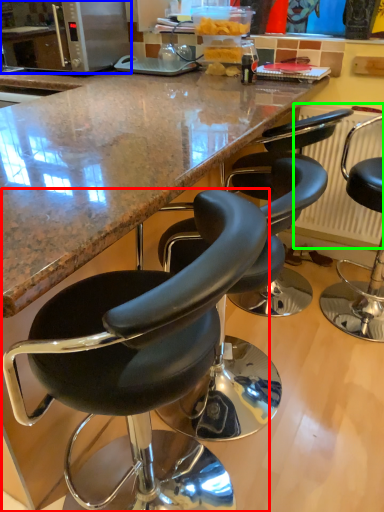
Question: Estimate the real-world distances between objects in this image. Which object is closer to chair (highlighted by a red box), microwave oven (highlighted by a blue box) or radiator (highlighted by a green box)?

Choices:
 (A) microwave oven
 (B) radiator

Answer: (B)